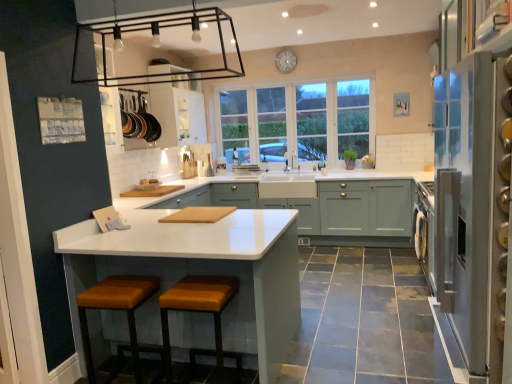
Image resolution: width=512 pixels, height=384 pixels. I want to click on orange fabric stool at lower center, placed as the second step stool when sorted from left to right, so click(199, 311).

The image size is (512, 384). What do you see at coordinates (179, 112) in the screenshot?
I see `white glossy cabinet at upper center, which is the second cabinetry in right-to-left order` at bounding box center [179, 112].

What do you see at coordinates (464, 201) in the screenshot? I see `clear glass refrigerator at right` at bounding box center [464, 201].

At what (x,y) coordinates should I click in order to perform the action: click on matte green cabinets at center, the 2th cabinetry when ordered from left to right. Please return your answer as a coordinate pair (x, y). Looking at the image, I should click on (324, 210).

Where is `white glossy countertop at center`? The image size is (512, 384). white glossy countertop at center is located at coordinates (204, 269).

Locate an element on the screen. Image resolution: width=512 pixels, height=384 pixels. orange fabric stool at lower center, placed as the second step stool when sorted from left to right is located at coordinates (199, 311).

Which object is wider, white glossy countertop at center or clear glass refrigerator at right?

white glossy countertop at center is wider.

Is white glossy countertop at center surrounding clear glass refrigerator at right?

Definitely not — clear glass refrigerator at right is not inside white glossy countertop at center.

Measure the distance from white glossy countertop at center to clear glass refrigerator at right.

white glossy countertop at center and clear glass refrigerator at right are 1.33 meters apart from each other.

How different are the orientations of orange fabric stool at lower center, placed as the second step stool when sorted from left to right, and leather-like brown stool at lower center, arranged as the 2th step stool when viewed from the right, in degrees?

2.26 degrees.

In the scene shown: Is orange fabric stool at lower center, placed as the second step stool when sorted from left to right, at the left side of leather-like brown stool at lower center, positioned as the 1th step stool in left-to-right order?

Incorrect, orange fabric stool at lower center, placed as the second step stool when sorted from left to right, is not on the left side of leather-like brown stool at lower center, positioned as the 1th step stool in left-to-right order.

Could you tell me if orange fabric stool at lower center, placed as the second step stool when sorted from left to right, is turned towards leather-like brown stool at lower center, positioned as the 1th step stool in left-to-right order?

No.

Who is shorter, orange fabric stool at lower center, placed as the second step stool when sorted from left to right, or leather-like brown stool at lower center, arranged as the 2th step stool when viewed from the right?

With less height is orange fabric stool at lower center, placed as the second step stool when sorted from left to right.

Is clear glass refrigerator at right spatially inside matte green cabinets at center, which is the 1th cabinetry from bottom to top, or outside of it?

clear glass refrigerator at right is not inside matte green cabinets at center, which is the 1th cabinetry from bottom to top, it's outside.

From the image's perspective, which is below, clear glass refrigerator at right or matte green cabinets at center, the 2th cabinetry when ordered from left to right?

clear glass refrigerator at right is shown below in the image.

Are clear glass refrigerator at right and matte green cabinets at center, which is the 1th cabinetry from bottom to top, beside each other?

No, clear glass refrigerator at right is not beside matte green cabinets at center, which is the 1th cabinetry from bottom to top.

Is point (485, 125) farther from viewer compared to point (339, 215)?

No, it is in front of (339, 215).

Is orange fabric stool at lower center, the 1th step stool in the right-to-left sequence, not close to white glass window at center?

orange fabric stool at lower center, the 1th step stool in the right-to-left sequence, is far away from white glass window at center.

What's the angular difference between orange fabric stool at lower center, the 1th step stool in the right-to-left sequence, and white glass window at center's facing directions?

The angular difference between orange fabric stool at lower center, the 1th step stool in the right-to-left sequence, and white glass window at center is 179 degrees.

From a real-world perspective, is orange fabric stool at lower center, the 1th step stool in the right-to-left sequence, under white glass window at center?

Yes, from a real-world perspective, orange fabric stool at lower center, the 1th step stool in the right-to-left sequence, is under white glass window at center.

Is orange fabric stool at lower center, the 1th step stool in the right-to-left sequence, not inside white glass window at center?

Yes.

Which point is more distant from viewer, (x=165, y=371) or (x=454, y=112)?

The point (x=165, y=371) is farther from the camera.

Considering the sizes of orange fabric stool at lower center, placed as the second step stool when sorted from left to right, and clear glass refrigerator at right in the image, is orange fabric stool at lower center, placed as the second step stool when sorted from left to right, taller or shorter than clear glass refrigerator at right?

Considering their sizes, orange fabric stool at lower center, placed as the second step stool when sorted from left to right, has less height than clear glass refrigerator at right.

Considering their positions, is orange fabric stool at lower center, the 1th step stool in the right-to-left sequence, located in front of or behind clear glass refrigerator at right?

Clearly, orange fabric stool at lower center, the 1th step stool in the right-to-left sequence, is behind clear glass refrigerator at right.

Is orange fabric stool at lower center, the 1th step stool in the right-to-left sequence, positioned with its back to clear glass refrigerator at right?

orange fabric stool at lower center, the 1th step stool in the right-to-left sequence, is not turned away from clear glass refrigerator at right.

Which of these two, white glossy cabinet at upper center, the 2th cabinetry from the bottom, or leather-like brown stool at lower center, positioned as the 1th step stool in left-to-right order, stands shorter?

leather-like brown stool at lower center, positioned as the 1th step stool in left-to-right order, is shorter.

Does white glossy cabinet at upper center, which is the second cabinetry in right-to-left order, contain leather-like brown stool at lower center, positioned as the 1th step stool in left-to-right order?

No, leather-like brown stool at lower center, positioned as the 1th step stool in left-to-right order, is located outside of white glossy cabinet at upper center, which is the second cabinetry in right-to-left order.

From a real-world perspective, is white glossy cabinet at upper center, marked as the first cabinetry in a left-to-right arrangement, over leather-like brown stool at lower center, arranged as the 2th step stool when viewed from the right?

Yes.

Could you tell me if white glass window at center is facing leather-like brown stool at lower center, arranged as the 2th step stool when viewed from the right?

Yes.

Is white glass window at center in contact with leather-like brown stool at lower center, positioned as the 1th step stool in left-to-right order?

No, white glass window at center is not touching leather-like brown stool at lower center, positioned as the 1th step stool in left-to-right order.

Looking at this image, can you confirm if white glass window at center is shorter than leather-like brown stool at lower center, arranged as the 2th step stool when viewed from the right?

No, white glass window at center is not shorter than leather-like brown stool at lower center, arranged as the 2th step stool when viewed from the right.

This screenshot has width=512, height=384. What are the coordinates of `countertop below the clear glass refrigerator at right (from the image's perspective)` in the screenshot? It's located at (204, 269).

This screenshot has width=512, height=384. In the image, there is a leather-like brown stool at lower center, positioned as the 1th step stool in left-to-right order. Identify the location of step stool above it (from the image's perspective). (199, 311).

When comparing their distances from white matte clock at upper center, does leather-like brown stool at lower center, positioned as the 1th step stool in left-to-right order, or white glossy countertop at center seem closer?

white glossy countertop at center is closer to white matte clock at upper center.

Looking at the image, which one is located closer to matte green cabinets at center, the 2th cabinetry when ordered from top to bottom, white glossy countertop at center or orange fabric stool at lower center, placed as the second step stool when sorted from left to right?

white glossy countertop at center is positioned closer to the anchor matte green cabinets at center, the 2th cabinetry when ordered from top to bottom.

Considering their positions, is white matte clock at upper center positioned further to orange fabric stool at lower center, placed as the second step stool when sorted from left to right, than white glossy countertop at center?

white matte clock at upper center lies further to orange fabric stool at lower center, placed as the second step stool when sorted from left to right, than the other object.

Which object lies further to the anchor point white glossy cabinet at upper center, marked as the first cabinetry in a left-to-right arrangement, white matte clock at upper center or white glass window at center?

white matte clock at upper center is positioned further to the anchor white glossy cabinet at upper center, marked as the first cabinetry in a left-to-right arrangement.

From the image, which object appears to be farther from white matte clock at upper center, matte green cabinets at center, the first cabinetry viewed from the right, or clear glass refrigerator at right?

clear glass refrigerator at right.

Considering their positions, is matte green cabinets at center, the first cabinetry viewed from the right, positioned closer to white matte clock at upper center than white glass window at center?

Based on the image, white glass window at center appears to be nearer to white matte clock at upper center.

From the image, which object appears to be farther from orange fabric stool at lower center, the 1th step stool in the right-to-left sequence, matte green cabinets at center, the 2th cabinetry when ordered from top to bottom, or white glossy countertop at center?

The object further to orange fabric stool at lower center, the 1th step stool in the right-to-left sequence, is matte green cabinets at center, the 2th cabinetry when ordered from top to bottom.

Estimate the real-world distances between objects in this image. Which object is further from white glossy cabinet at upper center, the 2th cabinetry from the bottom, matte green cabinets at center, the first cabinetry viewed from the right, or leather-like brown stool at lower center, positioned as the 1th step stool in left-to-right order?

leather-like brown stool at lower center, positioned as the 1th step stool in left-to-right order.

Find the location of a particular element. The height and width of the screenshot is (384, 512). step stool between orange fabric stool at lower center, placed as the second step stool when sorted from left to right, and matte green cabinets at center, which is the 1th cabinetry from bottom to top, in the front-back direction is located at coordinates (118, 310).

Identify the location of step stool between orange fabric stool at lower center, the 1th step stool in the right-to-left sequence, and white matte clock at upper center in the front-back direction. (118, 310).

Where is `countertop located between clear glass refrigerator at right and matte green cabinets at center, the 2th cabinetry when ordered from left to right, in the depth direction`? This screenshot has height=384, width=512. countertop located between clear glass refrigerator at right and matte green cabinets at center, the 2th cabinetry when ordered from left to right, in the depth direction is located at coordinates (204, 269).

The height and width of the screenshot is (384, 512). In order to click on step stool between orange fabric stool at lower center, placed as the second step stool when sorted from left to right, and white glossy cabinet at upper center, the 2th cabinetry from the bottom, along the z-axis in this screenshot , I will do `click(118, 310)`.